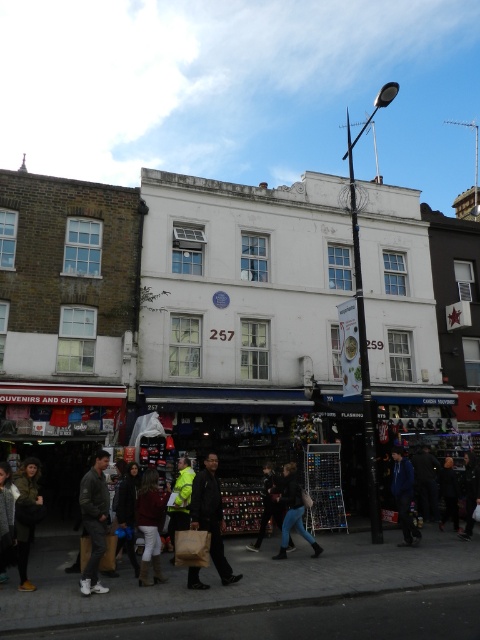
You are standing in front of the building numbered 257 and looking at the two points on its facade. Which point, point (208, 586) or point (287, 513), is closer to you?

Point (208, 586) is closer to you than point (287, 513).

You are a street vendor who needs to hang a sign that is 0.5 meters wide between the leather jacket at lower left and the high visibility yellow jacket at center. Based on their widths, will the sign fit between them?

The leather jacket at lower left has a lesser width compared to high visibility yellow jacket at center. Since the sign is 0.5 meters wide, and the combined width of both jackets is greater than 0.5 meters, the sign should fit between them.